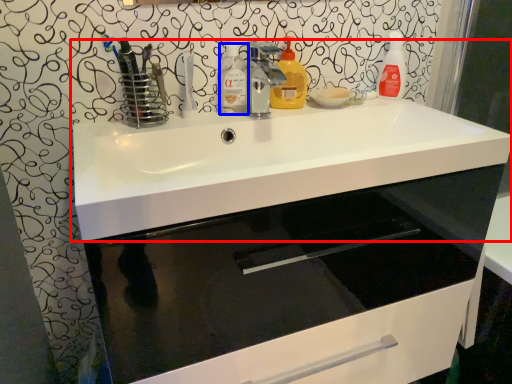
Question: Among these objects, which one is farthest to the camera, sink (highlighted by a red box) or cleaning product (highlighted by a blue box)?

Choices:
 (A) sink
 (B) cleaning product

Answer: (B)